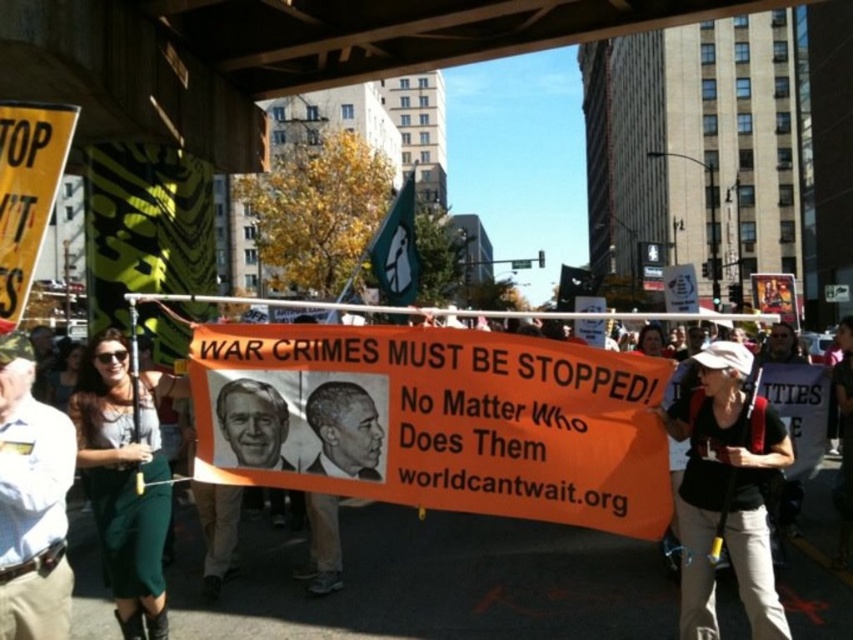
Question: Which point appears farthest from the camera in this image?

Choices:
 (A) (254, 429)
 (B) (21, 417)
 (C) (567, 518)

Answer: (A)

Question: Can you confirm if orange fabric banner at center is bigger than white shirt at center?

Choices:
 (A) yes
 (B) no

Answer: (A)

Question: Estimate the real-world distances between objects in this image. Which object is farther from the smooth black portrait at center?

Choices:
 (A) white fabric backpack at center-right
 (B) green fabric dress at left
 (C) white shirt at center
 (D) smooth beige portrait at center

Answer: (A)

Question: Is smooth black portrait at center further to camera compared to smooth beige portrait at center?

Choices:
 (A) no
 (B) yes

Answer: (A)

Question: Among these points, which one is farthest from the camera?

Choices:
 (A) (752, 522)
 (B) (164, 468)

Answer: (B)

Question: From the image, what is the correct spatial relationship of green fabric dress at left in relation to white shirt at center?

Choices:
 (A) left
 (B) right

Answer: (A)